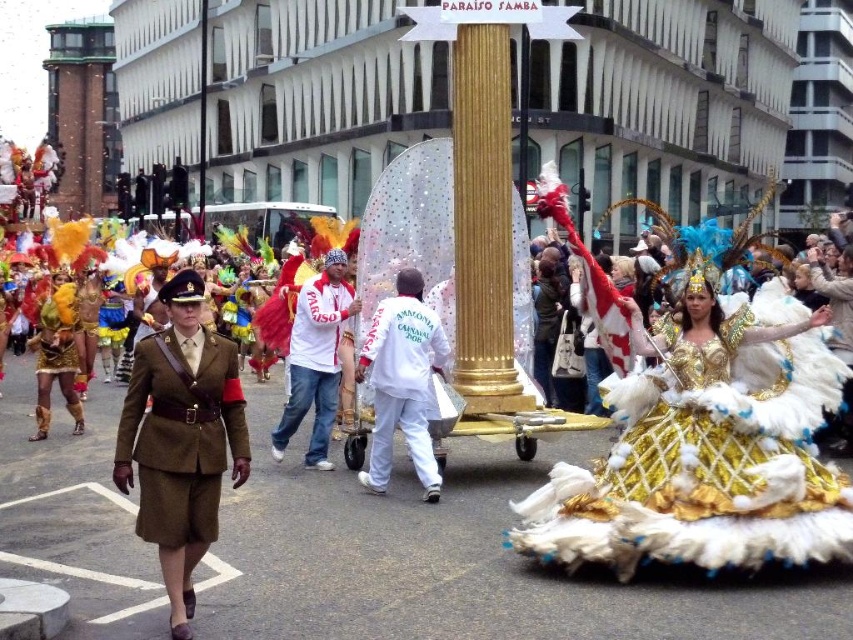
You are a photographer at the carnival parade and want to capture both the point at coordinates point (x=173, y=378) and point (x=302, y=352) in your shot. Which point should you focus on first to ensure both are in focus?

You should focus on point (x=173, y=378) first because it is closer to the viewer than point (x=302, y=352), ensuring both will be in focus when using a shallow depth of field.

You are a photographer at the carnival parade. You need to capture a photo that includes both the gold sequined dress at center and the white matte uniform at center. Considering their sizes, which one should you focus on to ensure both fit in the frame?

The gold sequined dress at center is wider than the white matte uniform at center, so you should focus on the gold sequined dress at center to ensure both fit in the frame.

What object is located at the coordinates point (402, 381) in the image?

The point (402, 381) corresponds to the white matte uniform at center.